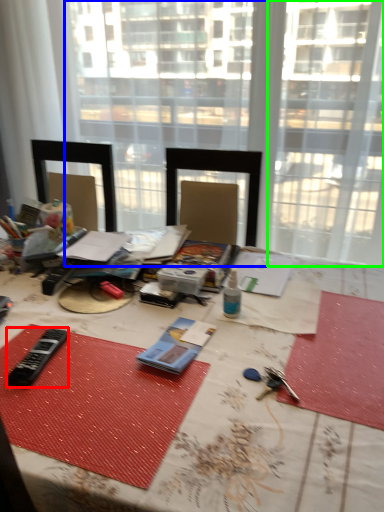
Question: Which object is the closest to the equipment (highlighted by a red box)? Choose among these: window (highlighted by a blue box) or window (highlighted by a green box).

Choices:
 (A) window
 (B) window

Answer: (B)